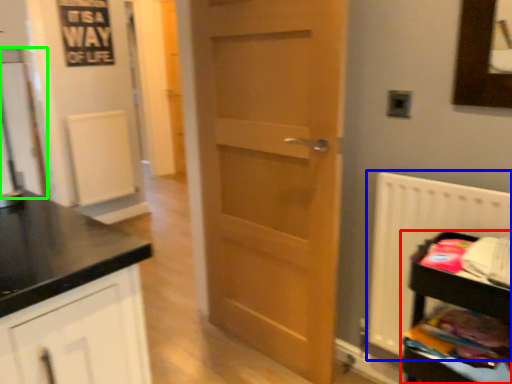
Question: Based on their relative distances, which object is nearer to shelf (highlighted by a red box)? Choose from radiator (highlighted by a blue box) and glass door (highlighted by a green box).

Choices:
 (A) radiator
 (B) glass door

Answer: (A)